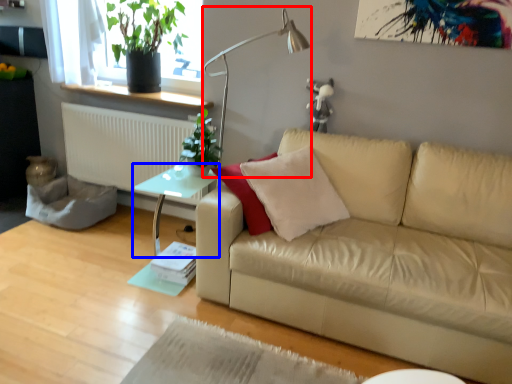
Question: Which object is closer to the camera taking this photo, table lamp (highlighted by a red box) or table (highlighted by a blue box)?

Choices:
 (A) table lamp
 (B) table

Answer: (A)